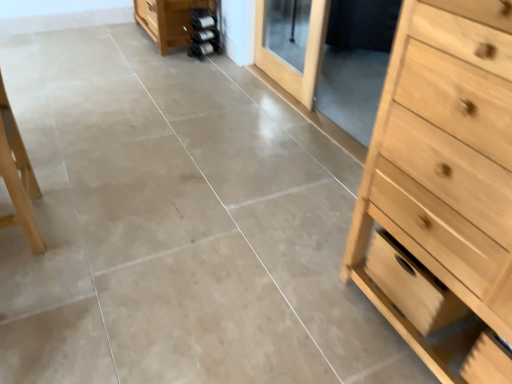
Image resolution: width=512 pixels, height=384 pixels. Describe the element at coordinates (443, 188) in the screenshot. I see `light wood chest of drawers at right` at that location.

The height and width of the screenshot is (384, 512). I want to click on light wood drawer at right, so click(411, 285).

Can you tell me how much light brown wooden screen door at upper center and light wood drawer at right differ in facing direction?

They differ by 1.87 degrees in their facing directions.

From a real-world perspective, relative to light wood drawer at right, is light brown wooden screen door at upper center vertically above or below?

light brown wooden screen door at upper center is above light wood drawer at right.

At what (x,y) coordinates should I click in order to perform the action: click on drawer that appears in front of the light brown wooden screen door at upper center. Please return your answer as a coordinate pair (x, y). Image resolution: width=512 pixels, height=384 pixels. Looking at the image, I should click on (411, 285).

From the image's perspective, which one is positioned lower, light brown wooden screen door at upper center or light wood drawer at right?

light wood drawer at right, from the image's perspective.

From the image's perspective, is light brown wooden screen door at upper center below light wood chest of drawers at right?

Incorrect, from the image's perspective, light brown wooden screen door at upper center is higher than light wood chest of drawers at right.

In the scene shown: Which of these two, light brown wooden screen door at upper center or light wood chest of drawers at right, is wider?

Wider between the two is light wood chest of drawers at right.

Does light brown wooden screen door at upper center appear on the left side of light wood chest of drawers at right?

A: Correct, you'll find light brown wooden screen door at upper center to the left of light wood chest of drawers at right.

From a real-world perspective, is light wood drawer at right over light brown wooden screen door at upper center?

No, from a real-world perspective, light wood drawer at right is not over light brown wooden screen door at upper center

Can you confirm if light wood drawer at right is shorter than light brown wooden screen door at upper center?

Indeed, light wood drawer at right has a lesser height compared to light brown wooden screen door at upper center.

Does light wood drawer at right have a smaller size compared to light brown wooden screen door at upper center?

Indeed, light wood drawer at right has a smaller size compared to light brown wooden screen door at upper center.

Considering the positions of point (414, 225) and point (306, 88), is point (414, 225) closer or farther from the camera than point (306, 88)?

Point (414, 225) is positioned closer to the camera compared to point (306, 88).

From the picture: From a real-world perspective, who is located higher, light wood chest of drawers at right or light brown wooden screen door at upper center?

light wood chest of drawers at right is physically above.

How many degrees apart are the facing directions of light wood chest of drawers at right and light brown wooden screen door at upper center?

The facing directions of light wood chest of drawers at right and light brown wooden screen door at upper center are 1.87 degrees apart.

From the image's perspective, is light wood chest of drawers at right positioned above or below light brown wooden screen door at upper center?

light wood chest of drawers at right is situated lower than light brown wooden screen door at upper center in the image.

In the scene shown: Can we say light wood drawer at right lies outside light wood chest of drawers at right?

No, light wood drawer at right is inside or overlapping with light wood chest of drawers at right.

From a real-world perspective, does light wood drawer at right stand above light wood chest of drawers at right?

No, from a real-world perspective, light wood drawer at right is not above light wood chest of drawers at right.

The image size is (512, 384). I want to click on chest of drawers on the right of light wood drawer at right, so click(443, 188).

Considering the sizes of light wood drawer at right and light wood chest of drawers at right in the image, is light wood drawer at right wider or thinner than light wood chest of drawers at right?

Considering their sizes, light wood drawer at right looks slimmer than light wood chest of drawers at right.

Is light wood chest of drawers at right oriented towards light wood drawer at right?

Yes, light wood chest of drawers at right is turned towards light wood drawer at right.

Based on their positions, is light wood chest of drawers at right located to the left or right of light wood drawer at right?

light wood chest of drawers at right is to the right of light wood drawer at right.

Which of these two, light wood chest of drawers at right or light wood drawer at right, is smaller?

light wood drawer at right is smaller.

Where is `screen door above the light wood drawer at right (from a real-world perspective)`? Image resolution: width=512 pixels, height=384 pixels. screen door above the light wood drawer at right (from a real-world perspective) is located at coordinates (291, 45).

Locate an element on the screen. This screenshot has height=384, width=512. screen door that appears above the light wood chest of drawers at right (from the image's perspective) is located at coordinates (291, 45).

Looking at the image, which one is located further to light wood drawer at right, light brown wooden screen door at upper center or light wood chest of drawers at right?

Based on the image, light brown wooden screen door at upper center appears to be further to light wood drawer at right.

Which object lies nearer to the anchor point light wood chest of drawers at right, light brown wooden screen door at upper center or light wood drawer at right?

Among the two, light wood drawer at right is located nearer to light wood chest of drawers at right.

Looking at the image, which one is located further to light wood drawer at right, light wood chest of drawers at right or light brown wooden screen door at upper center?

light brown wooden screen door at upper center is positioned further to the anchor light wood drawer at right.

Consider the image. Looking at the image, which one is located further to light brown wooden screen door at upper center, light wood drawer at right or light wood chest of drawers at right?

light wood chest of drawers at right is positioned further to the anchor light brown wooden screen door at upper center.

Estimate the real-world distances between objects in this image. Which object is further from light wood chest of drawers at right, light wood drawer at right or light brown wooden screen door at upper center?

light brown wooden screen door at upper center.

Estimate the real-world distances between objects in this image. Which object is closer to light brown wooden screen door at upper center, light wood chest of drawers at right or light wood drawer at right?

Based on the image, light wood drawer at right appears to be nearer to light brown wooden screen door at upper center.

The height and width of the screenshot is (384, 512). Identify the location of drawer between light wood chest of drawers at right and light brown wooden screen door at upper center along the z-axis. point(411,285).